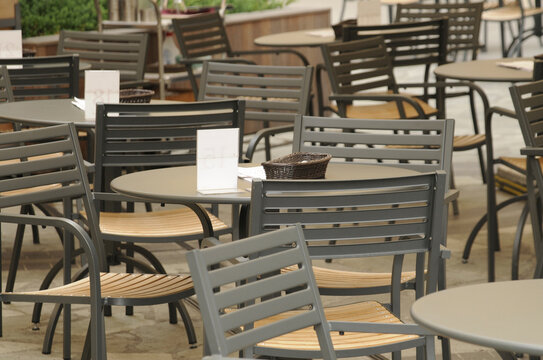
The image size is (543, 360). Identify the location of dark wooden baskets. (132, 94), (294, 166), (337, 29), (29, 50).